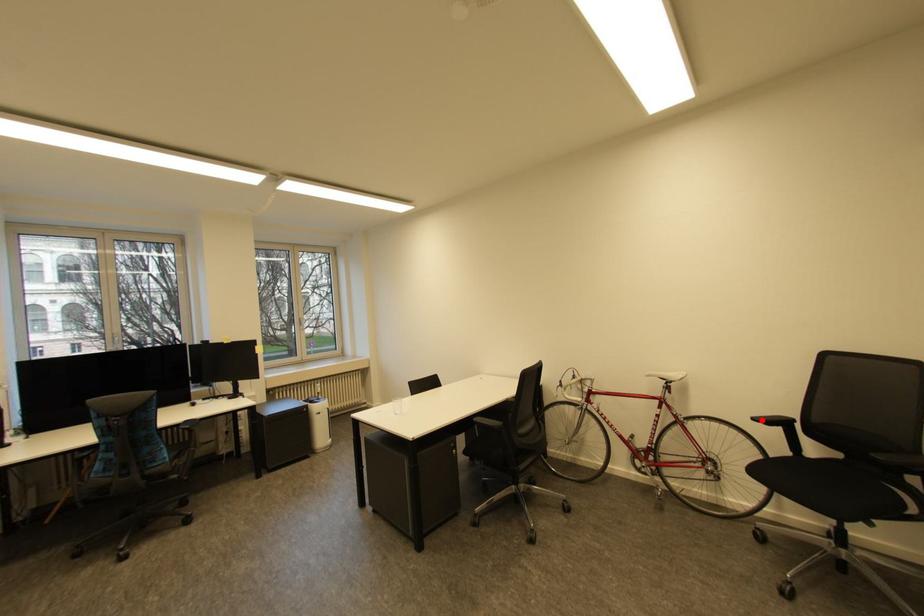
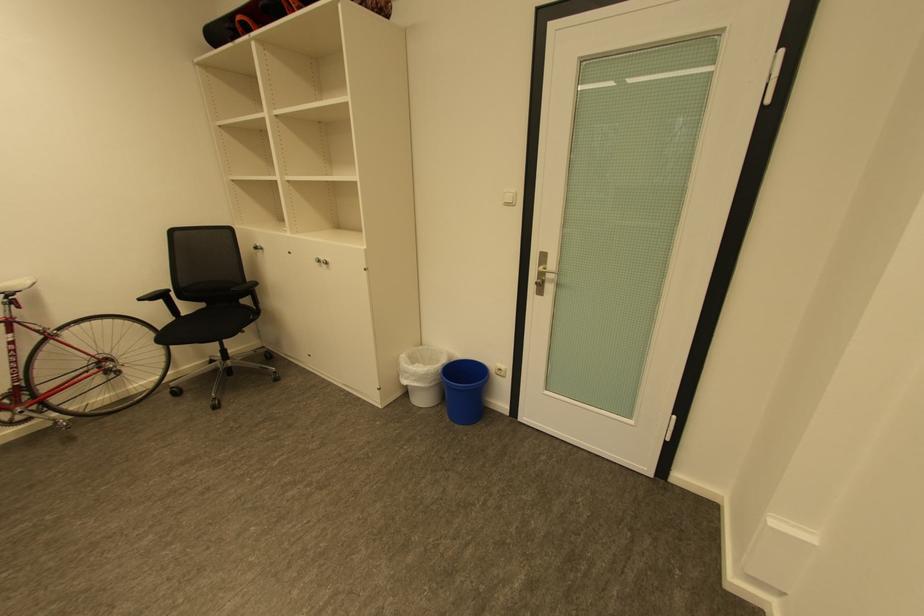
Where in the second image is the point corresponding to the highlighted location from the first image?

(148, 300)